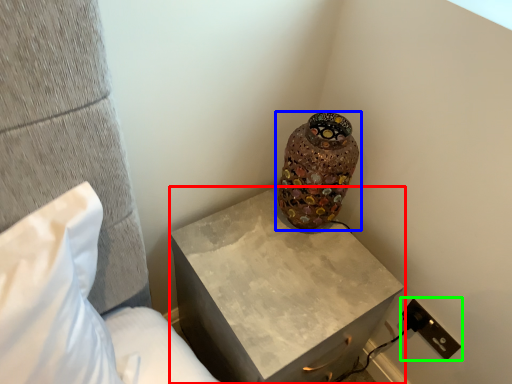
Question: Estimate the real-world distances between objects in this image. Which object is farther from nightstand (highlighted by a red box), vase (highlighted by a blue box) or electric outlet (highlighted by a green box)?

Choices:
 (A) vase
 (B) electric outlet

Answer: (B)